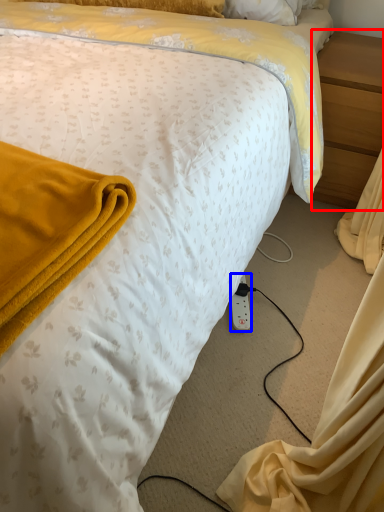
Question: Which of the following is the farthest to the observer, nightstand (highlighted by a red box) or power outlet (highlighted by a blue box)?

Choices:
 (A) nightstand
 (B) power outlet

Answer: (A)